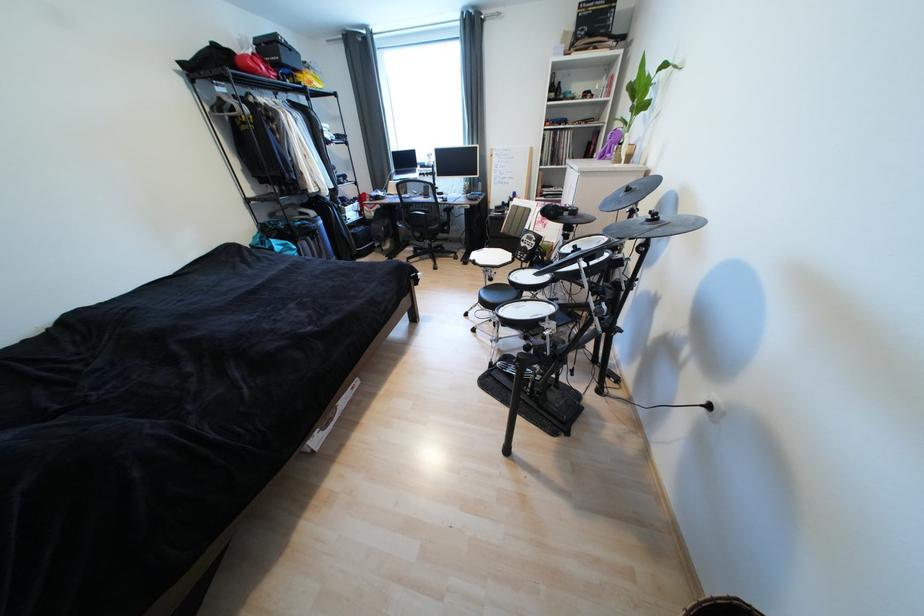
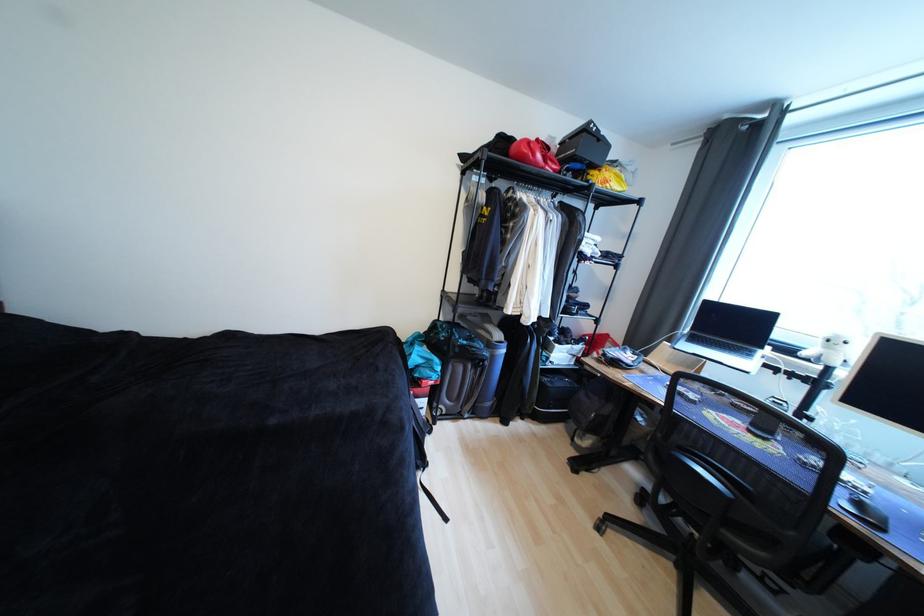
The point at [261,73] is marked in the first image. Where is the corresponding point in the second image?

(529, 159)